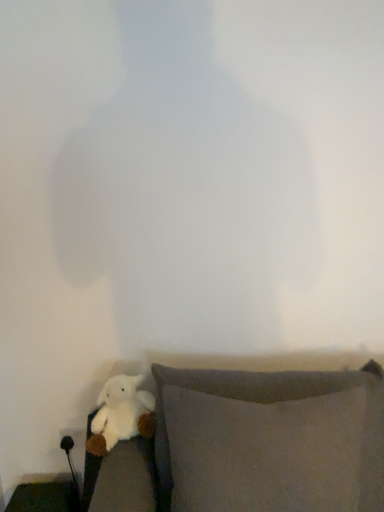
The height and width of the screenshot is (512, 384). I want to click on matte black side table at lower left, positioned as the first furniture in bottom-to-top order, so click(45, 497).

The height and width of the screenshot is (512, 384). In order to click on gray fabric pillow at lower right, the 1th furniture positioned from the top in this screenshot , I will do `click(252, 444)`.

Is matte black side table at lower left, positioned as the first furniture in left-to-right order, in front of or behind white plush toy at lower left in the image?

In the image, matte black side table at lower left, positioned as the first furniture in left-to-right order, appears behind white plush toy at lower left.

How different are the orientations of matte black side table at lower left, placed as the second furniture when sorted from top to bottom, and white plush toy at lower left in degrees?

The angle between the facing direction of matte black side table at lower left, placed as the second furniture when sorted from top to bottom, and the facing direction of white plush toy at lower left is 0.611 degrees.

Does matte black side table at lower left, positioned as the first furniture in left-to-right order, have a greater height compared to white plush toy at lower left?

No.

Is white plush toy at lower left closer to camera compared to matte black side table at lower left, positioned as the first furniture in left-to-right order?

Yes, white plush toy at lower left is closer to the camera.

Which of these two, white plush toy at lower left or matte black side table at lower left, positioned as the first furniture in left-to-right order, is thinner?

Thinner between the two is matte black side table at lower left, positioned as the first furniture in left-to-right order.

Is white plush toy at lower left to the left of matte black side table at lower left, positioned as the second furniture in front-to-back order, from the viewer's perspective?

Incorrect, white plush toy at lower left is not on the left side of matte black side table at lower left, positioned as the second furniture in front-to-back order.

Looking at this image, in terms of height, does white plush toy at lower left look taller or shorter compared to matte black side table at lower left, positioned as the first furniture in bottom-to-top order?

Clearly, white plush toy at lower left is taller compared to matte black side table at lower left, positioned as the first furniture in bottom-to-top order.

Which is farther, (134, 399) or (234, 506)?

The point (134, 399) is farther.

Between white plush toy at lower left and gray fabric pillow at lower right, which is the 2th furniture in bottom-to-top order, which one appears on the left side from the viewer's perspective?

white plush toy at lower left is more to the left.

Which of these two, matte black side table at lower left, arranged as the second furniture when viewed from the right, or gray fabric pillow at lower right, which is counted as the 1th furniture, starting from the front, stands shorter?

With less height is matte black side table at lower left, arranged as the second furniture when viewed from the right.

How many degrees apart are the facing directions of matte black side table at lower left, arranged as the second furniture when viewed from the right, and gray fabric pillow at lower right, which is counted as the 1th furniture, starting from the front?

The angular difference between matte black side table at lower left, arranged as the second furniture when viewed from the right, and gray fabric pillow at lower right, which is counted as the 1th furniture, starting from the front, is 5.74 degrees.

Measure the distance between matte black side table at lower left, placed as the second furniture when sorted from top to bottom, and gray fabric pillow at lower right, acting as the second furniture starting from the back.

They are 74.96 centimeters apart.

Between point (11, 502) and point (362, 434), which one is positioned in front?

The point (362, 434) is in front.

Considering the sizes of gray fabric pillow at lower right, which is the 2th furniture in bottom-to-top order, and matte black side table at lower left, positioned as the first furniture in bottom-to-top order, in the image, is gray fabric pillow at lower right, which is the 2th furniture in bottom-to-top order, bigger or smaller than matte black side table at lower left, positioned as the first furniture in bottom-to-top order,?

gray fabric pillow at lower right, which is the 2th furniture in bottom-to-top order, is bigger than matte black side table at lower left, positioned as the first furniture in bottom-to-top order.

Between gray fabric pillow at lower right, acting as the second furniture starting from the back, and matte black side table at lower left, positioned as the first furniture in bottom-to-top order, which one has larger width?

With larger width is gray fabric pillow at lower right, acting as the second furniture starting from the back.

Are gray fabric pillow at lower right, acting as the second furniture starting from the back, and matte black side table at lower left, positioned as the first furniture in left-to-right order, far apart?

No, gray fabric pillow at lower right, acting as the second furniture starting from the back, is not far away from matte black side table at lower left, positioned as the first furniture in left-to-right order.

Which is in front, point (264, 383) or point (46, 485)?

The point (264, 383) is closer.

From the picture: From a real-world perspective, which is physically below, gray fabric pillow at lower right, which is counted as the 1th furniture, starting from the front, or white plush toy at lower left?

gray fabric pillow at lower right, which is counted as the 1th furniture, starting from the front, is physically lower.

Between gray fabric pillow at lower right, the 1th furniture when ordered from right to left, and white plush toy at lower left, which one appears on the right side from the viewer's perspective?

gray fabric pillow at lower right, the 1th furniture when ordered from right to left, is more to the right.

Which is in front, point (274, 386) or point (106, 405)?

The point (274, 386) is closer.

From a real-world perspective, count 2nd furnitures downward from the white plush toy at lower left and point to it. Please provide its 2D coordinates.

[(45, 497)]

At what (x,y) coordinates should I click in order to perform the action: click on furniture on the left of white plush toy at lower left. Please return your answer as a coordinate pair (x, y). Image resolution: width=384 pixels, height=512 pixels. Looking at the image, I should click on (45, 497).

Estimate the real-world distances between objects in this image. Which object is closer to gray fabric pillow at lower right, which is counted as the 1th furniture, starting from the front, white plush toy at lower left or matte black side table at lower left, positioned as the first furniture in bottom-to-top order?

Based on the image, white plush toy at lower left appears to be nearer to gray fabric pillow at lower right, which is counted as the 1th furniture, starting from the front.

Estimate the real-world distances between objects in this image. Which object is closer to white plush toy at lower left, gray fabric pillow at lower right, acting as the second furniture starting from the back, or matte black side table at lower left, positioned as the second furniture in front-to-back order?

gray fabric pillow at lower right, acting as the second furniture starting from the back, lies closer to white plush toy at lower left than the other object.

Looking at the image, which one is located closer to matte black side table at lower left, which ranks as the 1th furniture in back-to-front order, white plush toy at lower left or gray fabric pillow at lower right, the 1th furniture positioned from the top?

The object closer to matte black side table at lower left, which ranks as the 1th furniture in back-to-front order, is white plush toy at lower left.

Looking at the image, which one is located closer to gray fabric pillow at lower right, which is the 2th furniture in bottom-to-top order, matte black side table at lower left, positioned as the first furniture in left-to-right order, or white plush toy at lower left?

Among the two, white plush toy at lower left is located nearer to gray fabric pillow at lower right, which is the 2th furniture in bottom-to-top order.

Considering their positions, is matte black side table at lower left, positioned as the first furniture in left-to-right order, positioned further to white plush toy at lower left than gray fabric pillow at lower right, placed as the second furniture when sorted from left to right?

matte black side table at lower left, positioned as the first furniture in left-to-right order, lies further to white plush toy at lower left than the other object.

Considering their positions, is gray fabric pillow at lower right, which is the 2th furniture in bottom-to-top order, positioned closer to matte black side table at lower left, positioned as the first furniture in bottom-to-top order, than white plush toy at lower left?

white plush toy at lower left lies closer to matte black side table at lower left, positioned as the first furniture in bottom-to-top order, than the other object.

Locate an element on the screen. The image size is (384, 512). toy between matte black side table at lower left, positioned as the second furniture in front-to-back order, and gray fabric pillow at lower right, the 1th furniture when ordered from right to left is located at coordinates (121, 414).